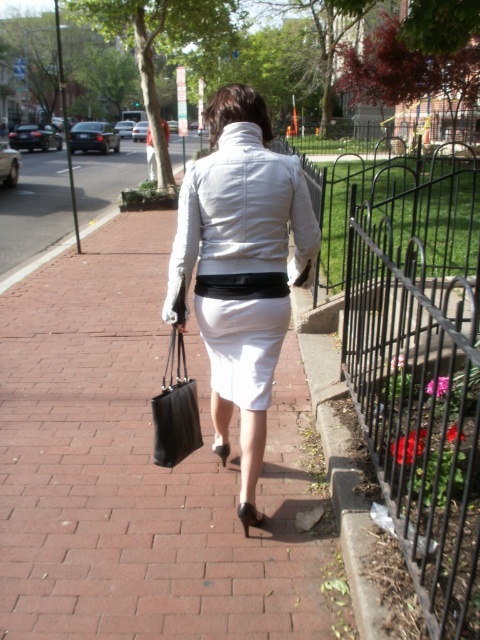
Does point (262, 371) come behind point (180, 396)?

No, it is in front of (180, 396).

Locate an element on the screen. The width and height of the screenshot is (480, 640). white cotton pencil skirt at center is located at coordinates (242, 346).

Is white matte skirt at center positioned at the back of black leather bag at center?

No, white matte skirt at center is closer to the viewer.

Is white matte skirt at center shorter than black leather bag at center?

No.

Does point (266, 385) lie behind point (181, 440)?

No, (266, 385) is closer to viewer.

The height and width of the screenshot is (640, 480). Find the location of `white matte skirt at center`. white matte skirt at center is located at coordinates (241, 268).

From the picture: Who is positioned more to the right, white matte skirt at center or white cotton pencil skirt at center?

From the viewer's perspective, white cotton pencil skirt at center appears more on the right side.

Can you confirm if white matte skirt at center is bigger than white cotton pencil skirt at center?

Yes, white matte skirt at center is bigger than white cotton pencil skirt at center.

Describe the element at coordinates (241, 268) in the screenshot. This screenshot has height=640, width=480. I see `white matte skirt at center` at that location.

Find the location of a particular element. white matte skirt at center is located at coordinates (241, 268).